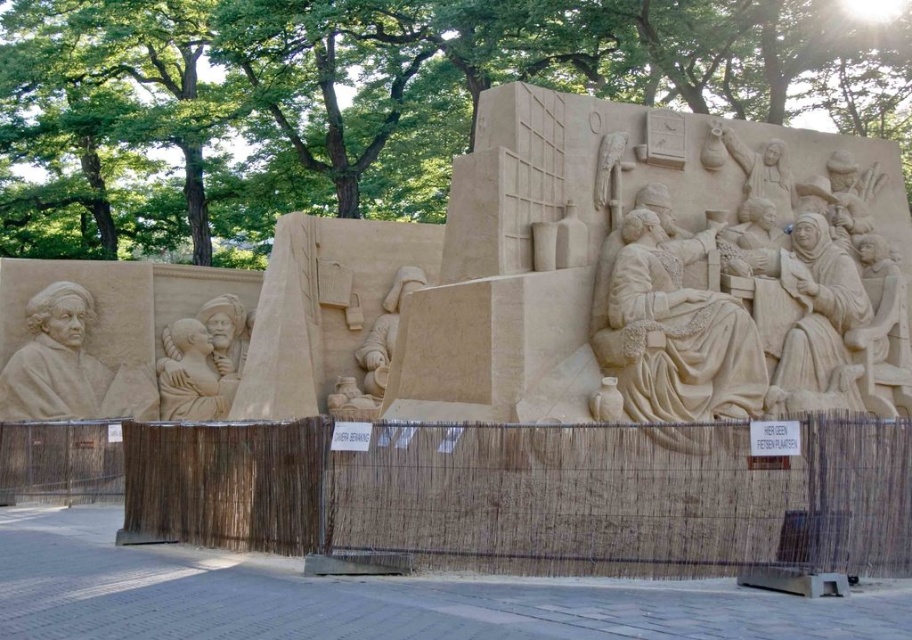
Who is higher up, sand relief figures at right or light beige sand sculpture at center?

sand relief figures at right is above.

Which is behind, point (689, 340) or point (799, 248)?

Point (799, 248)

Which is behind, point (705, 394) or point (843, 273)?

Positioned behind is point (843, 273).

The image size is (912, 640). I want to click on sand relief figures at right, so click(x=751, y=292).

Is point (650, 253) more distant than point (812, 292)?

No, it is not.

Is smooth beige figure at center bigger than light beige sand sculpture at center?

Indeed, smooth beige figure at center has a larger size compared to light beige sand sculpture at center.

Measure the distance between smooth beige figure at center and camera.

A distance of 53.98 meters exists between smooth beige figure at center and camera.

Locate an element on the screen. This screenshot has width=912, height=640. smooth beige figure at center is located at coordinates (674, 332).

Measure the distance between smooth beige bust at left and camera.

smooth beige bust at left is 243.85 feet away from camera.

Which of these two, smooth beige bust at left or smooth sand sculpture at center, stands taller?

smooth beige bust at left is taller.

I want to click on smooth beige bust at left, so click(x=54, y=360).